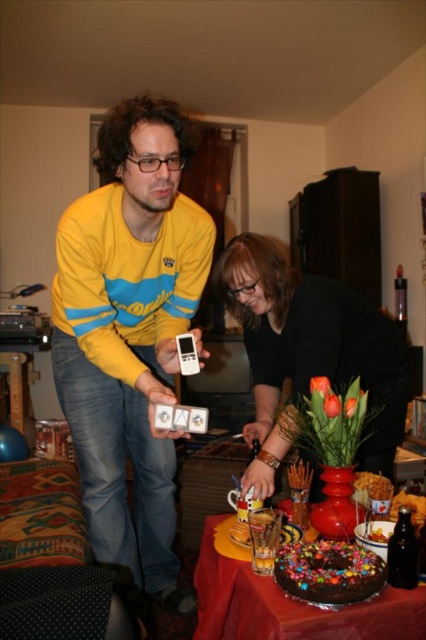
Question: Which of the following is the closest to the observer?

Choices:
 (A) yellow long-sleeve shirt at upper left
 (B) black matte vase at center
 (C) yellow long-sleeve shirt at left

Answer: (C)

Question: Can you confirm if yellow long-sleeve shirt at left is bigger than chocolate frosted cake at lower center?

Choices:
 (A) yes
 (B) no

Answer: (A)

Question: Does black matte vase at center appear on the left side of chocolate cake at center?

Choices:
 (A) yes
 (B) no

Answer: (B)

Question: Which point is closer to the camera?

Choices:
 (A) yellow long-sleeve shirt at left
 (B) yellow long-sleeve shirt at upper left

Answer: (A)

Question: Is yellow long-sleeve shirt at left smaller than chocolate cake at center?

Choices:
 (A) no
 (B) yes

Answer: (A)

Question: Which point is farther from the camera taking this photo?

Choices:
 (A) (63, 248)
 (B) (379, 566)
 (C) (276, 321)

Answer: (C)